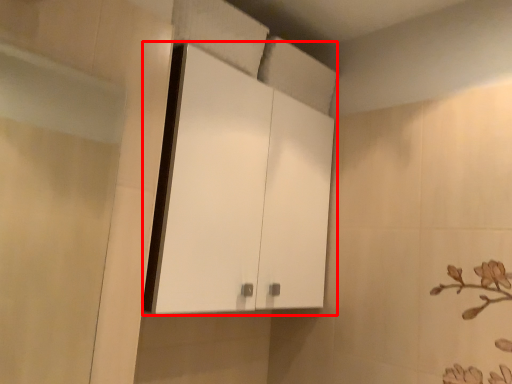
Question: From the image's perspective, what is the correct spatial relationship of cabinetry (annotated by the red box) in relation to screen door?

Choices:
 (A) below
 (B) above

Answer: (B)